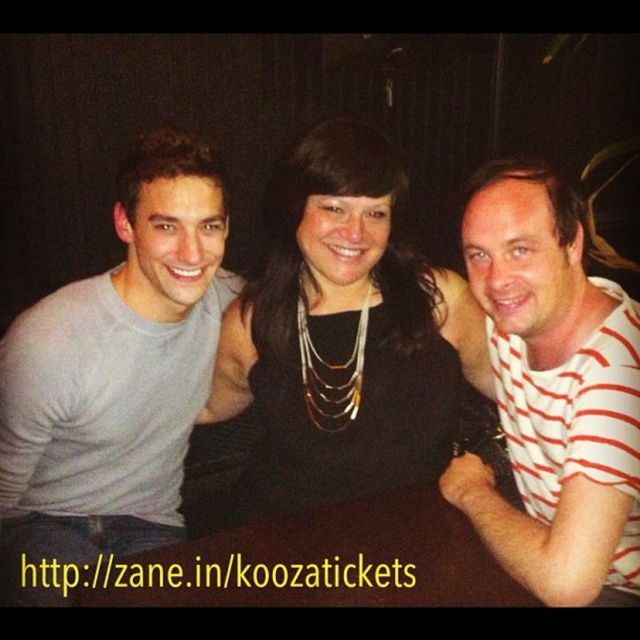
Can you confirm if gray cotton shirt at left is smaller than black fabric dress at center?

Indeed, gray cotton shirt at left has a smaller size compared to black fabric dress at center.

You are a GUI agent. You are given a task and a screenshot of the screen. Output one action in this format:
    pyautogui.click(x=<x>, y=<y>)
    Task: Click on the gray cotton shirt at left
    Image resolution: width=640 pixels, height=640 pixels.
    Given the screenshot: What is the action you would take?
    pyautogui.click(x=115, y=378)

Who is more distant from viewer, (200,275) or (250,385)?

The point (250,385) is more distant.

This screenshot has height=640, width=640. In order to click on gray cotton shirt at left in this screenshot , I will do `click(115, 378)`.

Between gray cotton shirt at left and brown wooden table at center, which one has less height?

Standing shorter between the two is brown wooden table at center.

Is gray cotton shirt at left wider than brown wooden table at center?

In fact, gray cotton shirt at left might be narrower than brown wooden table at center.

Is point (42, 300) closer to camera compared to point (141, 554)?

No, (42, 300) is further to viewer.

Where is `gray cotton shirt at left`? gray cotton shirt at left is located at coordinates (115, 378).

From the picture: Is black fabric dress at center thinner than white striped shirt at center?

In fact, black fabric dress at center might be wider than white striped shirt at center.

Between black fabric dress at center and white striped shirt at center, which one has less height?

white striped shirt at center

Measure the distance between black fabric dress at center and camera.

They are 3.58 feet apart.

This screenshot has width=640, height=640. In order to click on black fabric dress at center in this screenshot , I will do `click(342, 333)`.